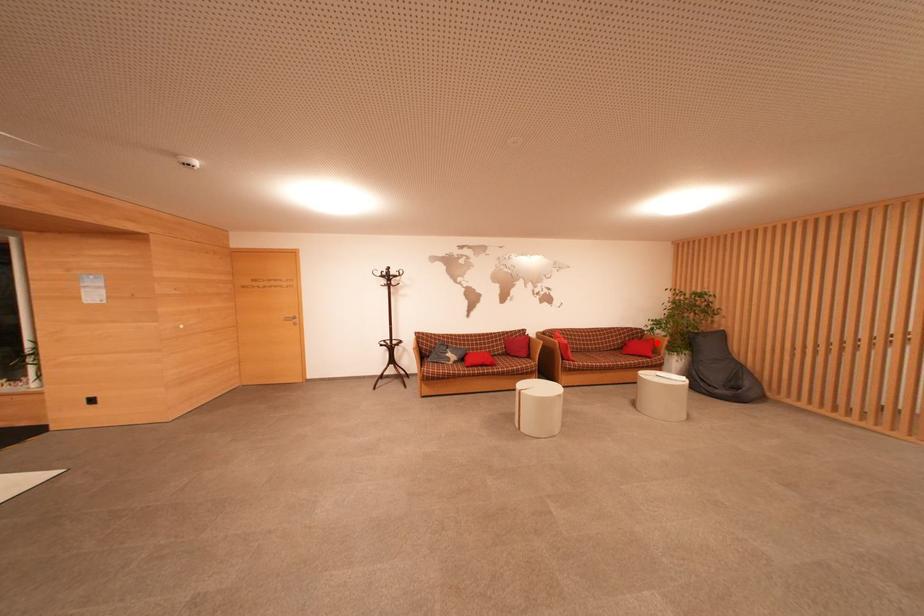
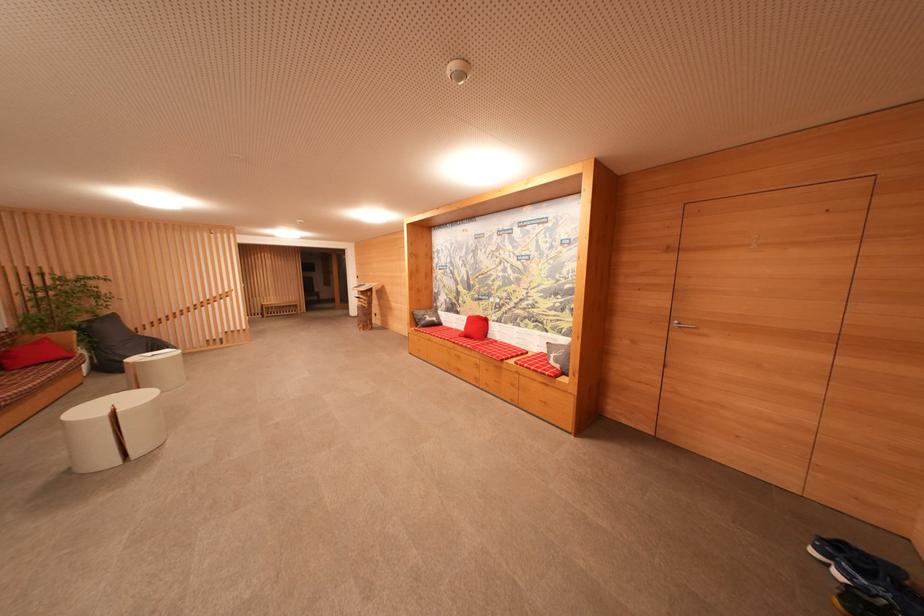
In the second image, find the point that corresponds to the highlighted location in the first image.

(50, 342)